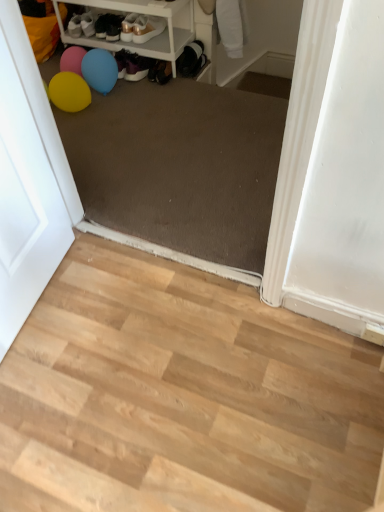
Where is `matte black shoes at upper center, which ranks as the 1th footwear in left-to-right order`? Image resolution: width=384 pixels, height=512 pixels. matte black shoes at upper center, which ranks as the 1th footwear in left-to-right order is located at coordinates (113, 27).

At what (x,y) coordinates should I click in order to perform the action: click on matte white shoe at upper left. Please return your answer as a coordinate pair (x, y). Image resolution: width=384 pixels, height=512 pixels. Looking at the image, I should click on [81, 25].

In order to click on pink rubber balloon at upper left in this screenshot , I will do `click(72, 59)`.

The height and width of the screenshot is (512, 384). Find the location of `matte white sneakers at upper center, the first footwear viewed from the right`. matte white sneakers at upper center, the first footwear viewed from the right is located at coordinates (147, 28).

Locate an element on the screen. The image size is (384, 512). matte black shoes at upper center, which ranks as the 1th footwear in left-to-right order is located at coordinates (113, 27).

From a real-world perspective, is pink rubber balloon at upper left beneath matte white sneakers at upper center, the third footwear from the left?

Yes, from a real-world perspective, pink rubber balloon at upper left is beneath matte white sneakers at upper center, the third footwear from the left.

Does pink rubber balloon at upper left turn towards matte white sneakers at upper center, the third footwear from the left?

No, pink rubber balloon at upper left is not aimed at matte white sneakers at upper center, the third footwear from the left.

Considering the relative sizes of pink rubber balloon at upper left and matte white sneakers at upper center, the third footwear from the left, in the image provided, is pink rubber balloon at upper left wider than matte white sneakers at upper center, the third footwear from the left,?

No, pink rubber balloon at upper left is not wider than matte white sneakers at upper center, the third footwear from the left.

Is pink rubber balloon at upper left next to matte white sneakers at upper center, the first footwear viewed from the right?

pink rubber balloon at upper left and matte white sneakers at upper center, the first footwear viewed from the right, are not in contact.

Can you confirm if matte white shoe at upper left is wider than pink rubber balloon at upper left?

Yes.

Is matte white shoe at upper left facing towards pink rubber balloon at upper left?

No, matte white shoe at upper left is not facing towards pink rubber balloon at upper left.

Identify the location of shoe above the pink rubber balloon at upper left (from the image's perspective). (81, 25).

From the image's perspective, is matte white shoe at upper left located above pink rubber balloon at upper left?

Yes, from the image's perspective, matte white shoe at upper left is over pink rubber balloon at upper left.

You are a GUI agent. You are given a task and a screenshot of the screen. Output one action in this format:
    pyautogui.click(x=<x>, y=<y>)
    Task: Click on the shoe that is above the shiny gold shoe at upper center, acting as the 2th footwear starting from the left (from a real-world perspective)
    Image resolution: width=384 pixels, height=512 pixels.
    Given the screenshot: What is the action you would take?
    pyautogui.click(x=81, y=25)

Between matte white shoe at upper left and shiny gold shoe at upper center, acting as the 2th footwear starting from the left, which one has smaller size?

With smaller size is matte white shoe at upper left.

Is matte white shoe at upper left in contact with shiny gold shoe at upper center, acting as the 2th footwear starting from the left?

No.

From a real-world perspective, is matte white shoe at upper left beneath shiny gold shoe at upper center, acting as the 2th footwear starting from the left?

No, from a real-world perspective, matte white shoe at upper left is not beneath shiny gold shoe at upper center, acting as the 2th footwear starting from the left.

How different are the orientations of shiny gold shoe at upper center, acting as the 2th footwear starting from the left, and matte white screen door at left in degrees?

shiny gold shoe at upper center, acting as the 2th footwear starting from the left, and matte white screen door at left are facing 97.4 degrees away from each other.

The width and height of the screenshot is (384, 512). What are the coordinates of `the 2nd footwear behind the matte white screen door at left, starting your count from the anchor` in the screenshot? It's located at (128, 27).

How far apart are shiny gold shoe at upper center, which ranks as the 2th footwear in right-to-left order, and matte white screen door at left?

shiny gold shoe at upper center, which ranks as the 2th footwear in right-to-left order, and matte white screen door at left are 4.93 feet apart.

From the picture: From a real-world perspective, which object rests below the other?

In real-world perspective, shiny gold shoe at upper center, which ranks as the 2th footwear in right-to-left order, is lower.

Does point (135, 17) appear closer or farther from the camera than point (75, 68)?

Point (135, 17).

Is shiny gold shoe at upper center, which ranks as the 2th footwear in right-to-left order, placed right next to pink rubber balloon at upper left?

No, shiny gold shoe at upper center, which ranks as the 2th footwear in right-to-left order, is not with pink rubber balloon at upper left.

Is shiny gold shoe at upper center, which ranks as the 2th footwear in right-to-left order, positioned behind pink rubber balloon at upper left?

Yes, shiny gold shoe at upper center, which ranks as the 2th footwear in right-to-left order, is behind pink rubber balloon at upper left.

Considering the sizes of objects shiny gold shoe at upper center, acting as the 2th footwear starting from the left, and pink rubber balloon at upper left in the image provided, who is taller, shiny gold shoe at upper center, acting as the 2th footwear starting from the left, or pink rubber balloon at upper left?

pink rubber balloon at upper left is taller.

Which is in front, point (53, 128) or point (131, 39)?

The point (53, 128) is closer.

Can you confirm if matte white screen door at left is positioned to the right of shiny gold shoe at upper center, acting as the 2th footwear starting from the left?

Incorrect, matte white screen door at left is not on the right side of shiny gold shoe at upper center, acting as the 2th footwear starting from the left.

Which is in front, matte white screen door at left or shiny gold shoe at upper center, which ranks as the 2th footwear in right-to-left order?

matte white screen door at left.

Could you tell me if matte white screen door at left is turned towards shiny gold shoe at upper center, acting as the 2th footwear starting from the left?

No, matte white screen door at left is not oriented towards shiny gold shoe at upper center, acting as the 2th footwear starting from the left.

Who is shorter, matte white sneakers at upper center, the first footwear viewed from the right, or white plastic shelf at upper left?

matte white sneakers at upper center, the first footwear viewed from the right, is shorter.

Looking at the image, does matte white sneakers at upper center, the third footwear from the left, seem bigger or smaller compared to white plastic shelf at upper left?

matte white sneakers at upper center, the third footwear from the left, is smaller than white plastic shelf at upper left.

Does point (141, 14) lie behind point (169, 4)?

Yes, it is.

You are a GUI agent. You are given a task and a screenshot of the screen. Output one action in this format:
    pyautogui.click(x=<x>, y=<y>)
    Task: Click on the balloon located on the left of matte white sneakers at upper center, the first footwear viewed from the right
    
    Given the screenshot: What is the action you would take?
    pyautogui.click(x=72, y=59)

The width and height of the screenshot is (384, 512). What are the coordinates of `balloon in front of the matte white shoe at upper left` in the screenshot? It's located at (72, 59).

Looking at this image, based on their spatial positions, is light wood floor at lower left or shiny gold shoe at upper center, which ranks as the 2th footwear in right-to-left order, closer to white plastic shelf at upper left?

shiny gold shoe at upper center, which ranks as the 2th footwear in right-to-left order, lies closer to white plastic shelf at upper left than the other object.

When comparing their distances from matte white shoe at upper left, does matte black shoes at upper center, which ranks as the 1th footwear in left-to-right order, or light wood floor at lower left seem further?

Based on the image, light wood floor at lower left appears to be further to matte white shoe at upper left.

Consider the image. When comparing their distances from matte white sneakers at upper center, the third footwear from the left, does white plastic shelf at upper left or matte white shoe at upper left seem closer?

The object closer to matte white sneakers at upper center, the third footwear from the left, is white plastic shelf at upper left.

Estimate the real-world distances between objects in this image. Which object is closer to matte white screen door at left, matte white sneakers at upper center, the first footwear viewed from the right, or pink rubber balloon at upper left?

pink rubber balloon at upper left is closer to matte white screen door at left.

Based on the photo, which object lies further to the anchor point matte white screen door at left, matte black shoes at upper center, the 3th footwear positioned from the right, or shiny gold shoe at upper center, acting as the 2th footwear starting from the left?

matte black shoes at upper center, the 3th footwear positioned from the right.

Estimate the real-world distances between objects in this image. Which object is closer to matte black shoes at upper center, the 3th footwear positioned from the right, shiny gold shoe at upper center, which ranks as the 2th footwear in right-to-left order, or matte white screen door at left?

The object closer to matte black shoes at upper center, the 3th footwear positioned from the right, is shiny gold shoe at upper center, which ranks as the 2th footwear in right-to-left order.

Which object lies further to the anchor point pink rubber balloon at upper left, matte white shoe at upper left or light wood floor at lower left?

The object further to pink rubber balloon at upper left is light wood floor at lower left.

From the image, which object appears to be farther from matte black shoes at upper center, the 3th footwear positioned from the right, matte white sneakers at upper center, the third footwear from the left, or shiny gold shoe at upper center, which ranks as the 2th footwear in right-to-left order?

matte white sneakers at upper center, the third footwear from the left, is positioned further to the anchor matte black shoes at upper center, the 3th footwear positioned from the right.

At what (x,y) coordinates should I click in order to perform the action: click on balloon located between matte white screen door at left and matte white shoe at upper left in the depth direction. Please return your answer as a coordinate pair (x, y). This screenshot has height=512, width=384. Looking at the image, I should click on (72, 59).

Where is `shelf located between matte white shoe at upper left and shiny gold shoe at upper center, acting as the 2th footwear starting from the left, in the left-right direction`? This screenshot has width=384, height=512. shelf located between matte white shoe at upper left and shiny gold shoe at upper center, acting as the 2th footwear starting from the left, in the left-right direction is located at coordinates (144, 13).

The image size is (384, 512). I want to click on balloon between matte white shoe at upper left and matte white sneakers at upper center, the third footwear from the left, from left to right, so click(x=72, y=59).

Where is `shelf between matte white screen door at left and matte white shoe at upper left in the front-back direction`? This screenshot has width=384, height=512. shelf between matte white screen door at left and matte white shoe at upper left in the front-back direction is located at coordinates (144, 13).